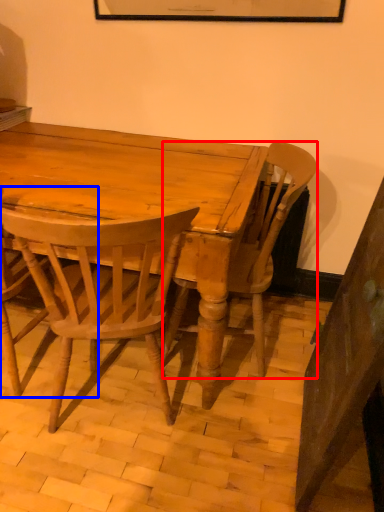
Question: Among these objects, which one is nearest to the camera, chair (highlighted by a red box) or chair (highlighted by a blue box)?

Choices:
 (A) chair
 (B) chair

Answer: (B)